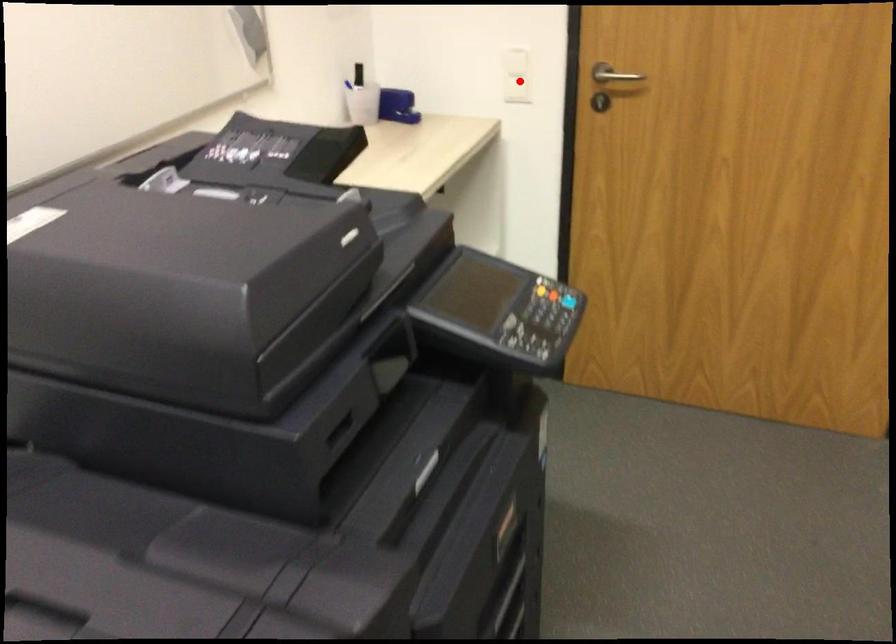
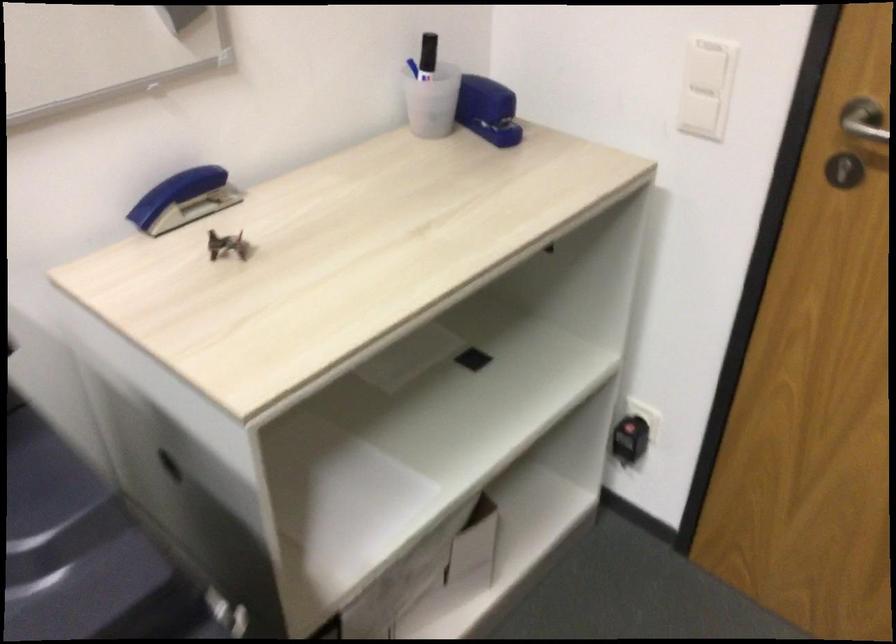
Question: I am providing you with two images of the same scene from different viewpoints. A red point is shown in image1. For the corresponding object point in image2, is it positioned nearer or farther from the camera?

Choices:
 (A) Nearer
 (B) Farther

Answer: (A)